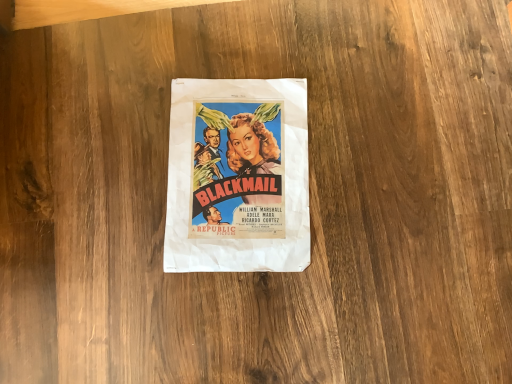
What is the approximate width of matte paper poster at center?

It is 12.30 inches.

Measure the distance between point (173, 107) and camera.

Point (173, 107) is 65.80 centimeters from camera.

In order to face matte paper poster at center, should I rotate leftwards or rightwards?

Rotate left and turn 2.710 degrees.

Locate an element on the screen. This screenshot has width=512, height=384. matte paper poster at center is located at coordinates (238, 176).

Describe the element at coordinates (238, 176) in the screenshot. I see `matte paper poster at center` at that location.

The height and width of the screenshot is (384, 512). What are the coordinates of `matte paper poster at center` in the screenshot? It's located at (238, 176).